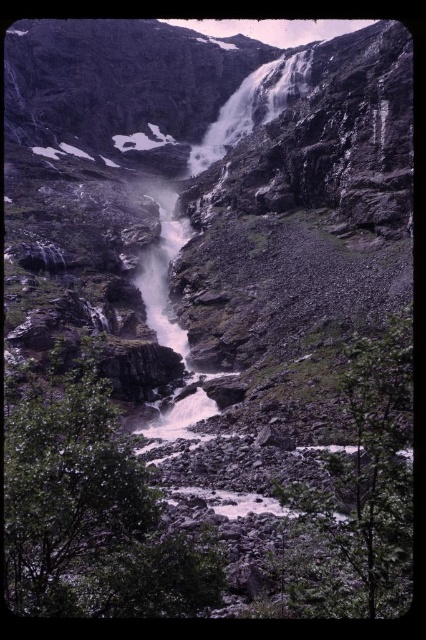
Is green leafy tree at center closer to the viewer compared to green leafy tree at lower right?

That is False.

Measure the distance between green leafy tree at center and camera.

green leafy tree at center is 37.42 meters away from camera.

The height and width of the screenshot is (640, 426). In order to click on green leafy tree at center in this screenshot , I will do (x=89, y=506).

Where is `green leafy tree at center`? This screenshot has height=640, width=426. green leafy tree at center is located at coordinates (89, 506).